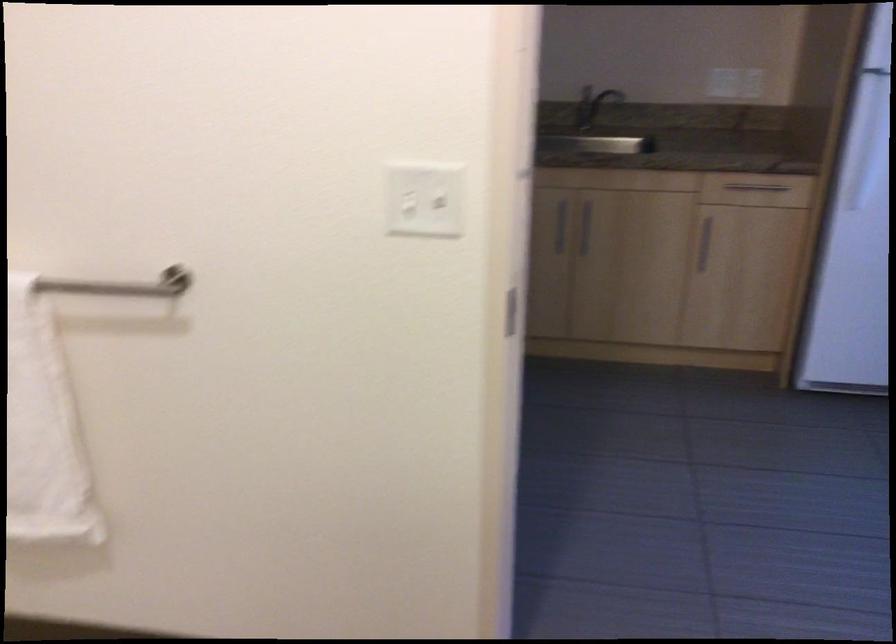
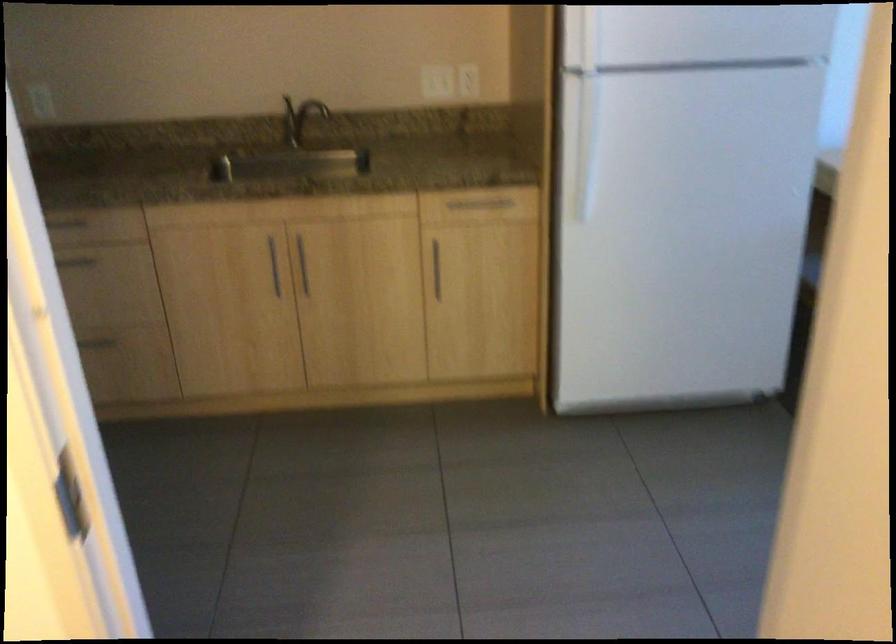
The images are taken continuously from a first-person perspective. In which direction are you moving?

The cameraman moved toward right, forward.